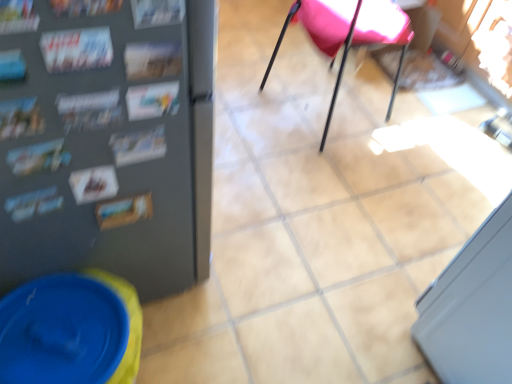
Locate an element on the screen. Image resolution: width=512 pixels, height=384 pixels. vacant location below pink fabric chair at center (from a real-world perspective) is located at coordinates (323, 105).